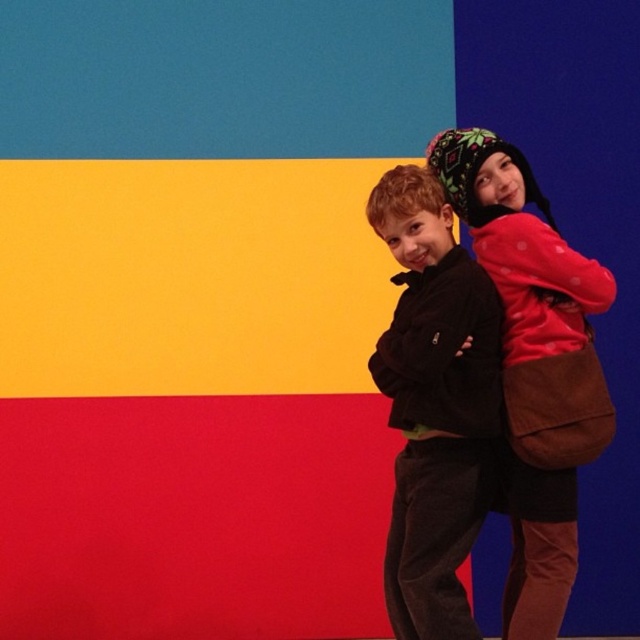
Does black fleece jacket at center appear under matte red sweater at right?

Yes.

Is black fleece jacket at center to the left of matte red sweater at right from the viewer's perspective?

Yes, black fleece jacket at center is to the left of matte red sweater at right.

Between point (429, 428) and point (586, 328), which one is positioned in front?

Point (429, 428) is in front.

The image size is (640, 640). What are the coordinates of `black fleece jacket at center` in the screenshot? It's located at (435, 404).